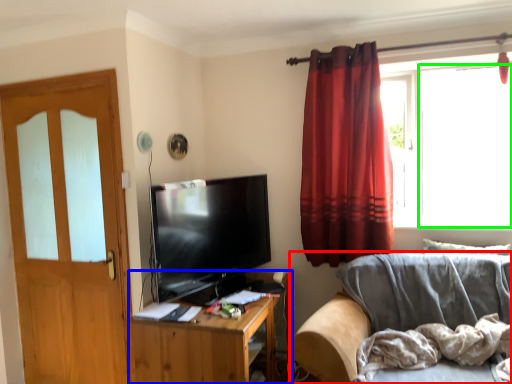
Question: Which object is positioned closest to studio couch (highlighted by a red box)? Select from cabinetry (highlighted by a blue box) and window screen (highlighted by a green box).

Choices:
 (A) cabinetry
 (B) window screen

Answer: (A)